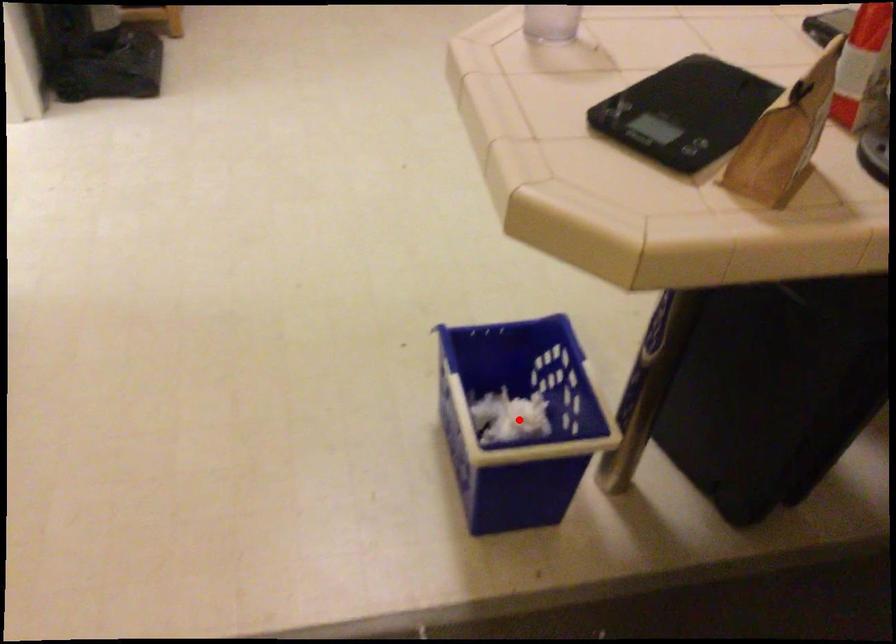
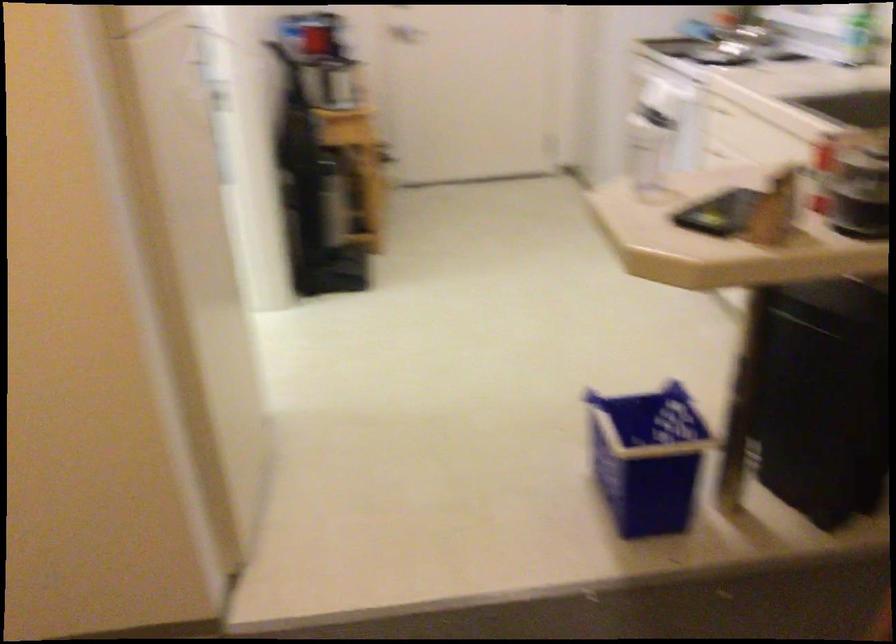
Question: I am providing you with two images of the same scene from different viewpoints. A red point is marked on the first image. At the location where the point appears in image 1, is it still visible in image 2?

Choices:
 (A) Yes
 (B) No

Answer: (B)